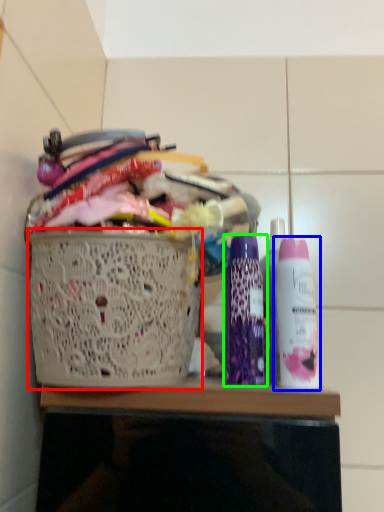
Question: Which object is positioned farthest from basket (highlighted by a red box)? Select from bottle (highlighted by a blue box) and bottle (highlighted by a green box).

Choices:
 (A) bottle
 (B) bottle

Answer: (A)